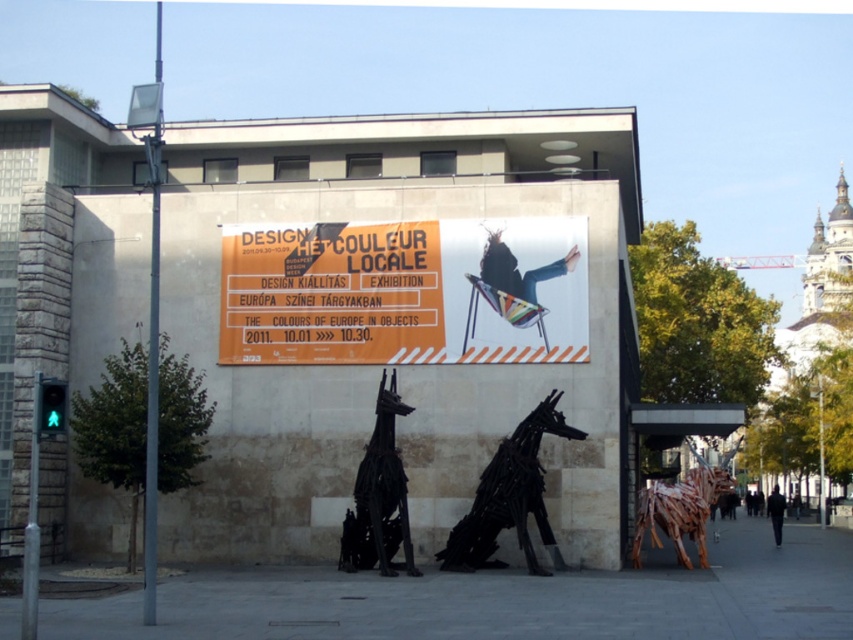
Question: Which of the following is the farthest from the observer?

Choices:
 (A) (498, 275)
 (B) (521, 326)
 (C) (525, 419)

Answer: (A)

Question: Can you confirm if black wire dog at center is positioned above metallic silver skateboard at upper center?

Choices:
 (A) no
 (B) yes

Answer: (A)

Question: Based on their relative distances, which object is nearer to the black wire dog at center?

Choices:
 (A) black metal sculpture at center
 (B) orange paper poster at center
 (C) wooden sculpture at lower right
 (D) metallic silver skateboard at upper center

Answer: (A)

Question: Which point appears closest to the camera in this image?

Choices:
 (A) [497, 301]
 (B) [396, 493]
 (C) [672, 486]
 (D) [526, 550]

Answer: (D)

Question: Considering the relative positions of black metal sculpture at center and metallic silver skateboard at upper center in the image provided, where is black metal sculpture at center located with respect to metallic silver skateboard at upper center?

Choices:
 (A) above
 (B) below

Answer: (B)

Question: Is black wire dog at center to the right of black metal sculpture at center from the viewer's perspective?

Choices:
 (A) yes
 (B) no

Answer: (A)